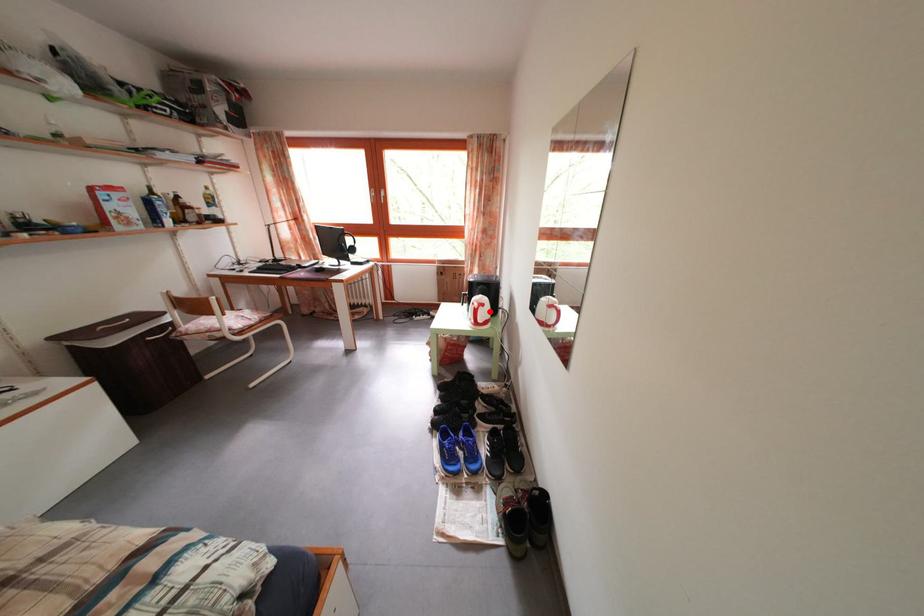
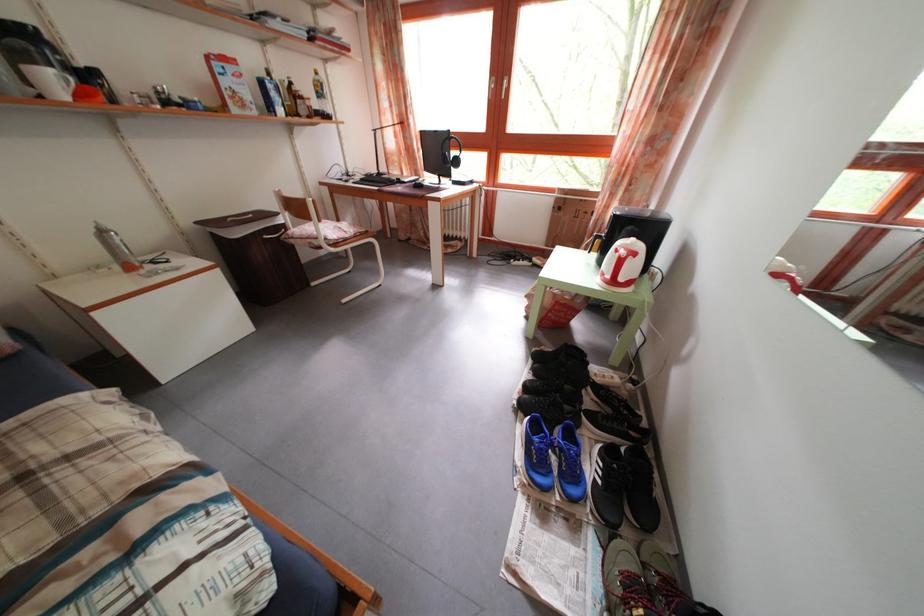
Find the pixel in the second image that matches the highlighted location in the first image.

(641, 262)